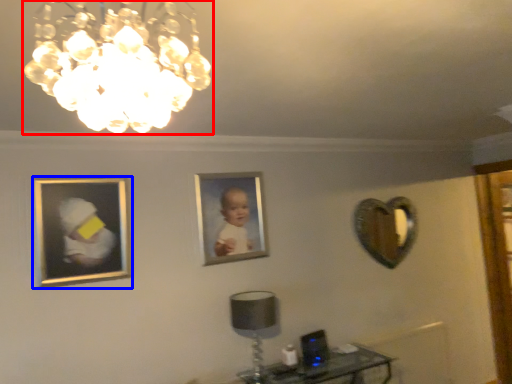
Question: Which object appears closest to the camera in this image, lamp (highlighted by a red box) or picture frame (highlighted by a blue box)?

Choices:
 (A) lamp
 (B) picture frame

Answer: (A)